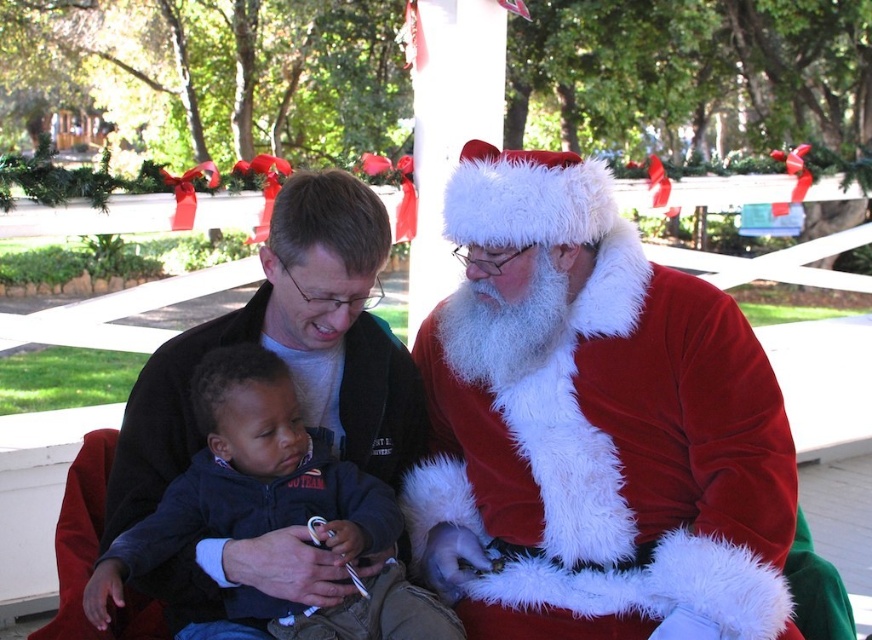
You are a photographer trying to capture a closeup of the velvet santa claus at center and the matte black jacket at center. Which object should you focus on first if you want to ensure both are in focus without moving the camera?

You should focus on the matte black jacket at center first because it is closer to the camera than the velvet santa claus at center, allowing the velvet santa claus at center to fall within the depth of field when focusing on the nearer object.

Consider the image. You are a photographer standing in front of the porch. You see two points marked in the scene. Which point is closer to your camera? The points are point [469,216] and point [171,397].

Point [171,397] is closer to the camera because the description states that point [469,216] is further away than point [171,397].

You are a photographer trying to capture a clear photo of the velvet santa claus at center and the matte black jacket at center. Since you want to focus on the taller object, which one should you adjust your camera to focus on?

The velvet santa claus at center is taller than the matte black jacket at center, so you should adjust your camera to focus on the velvet santa claus at center.